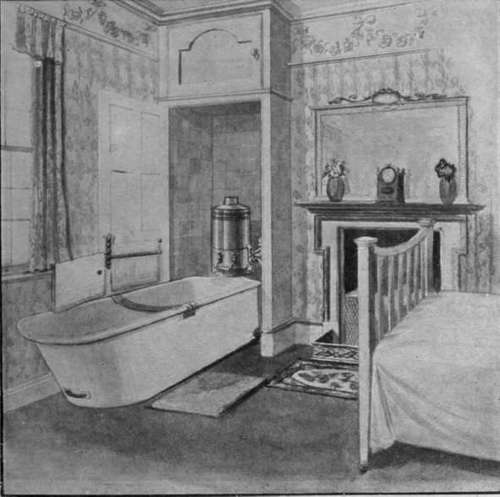
At what (x,y) coordinates should I click in order to perform the action: click on bedpost. Please return your answer as a coordinate pair (x, y). Looking at the image, I should click on (364, 344).